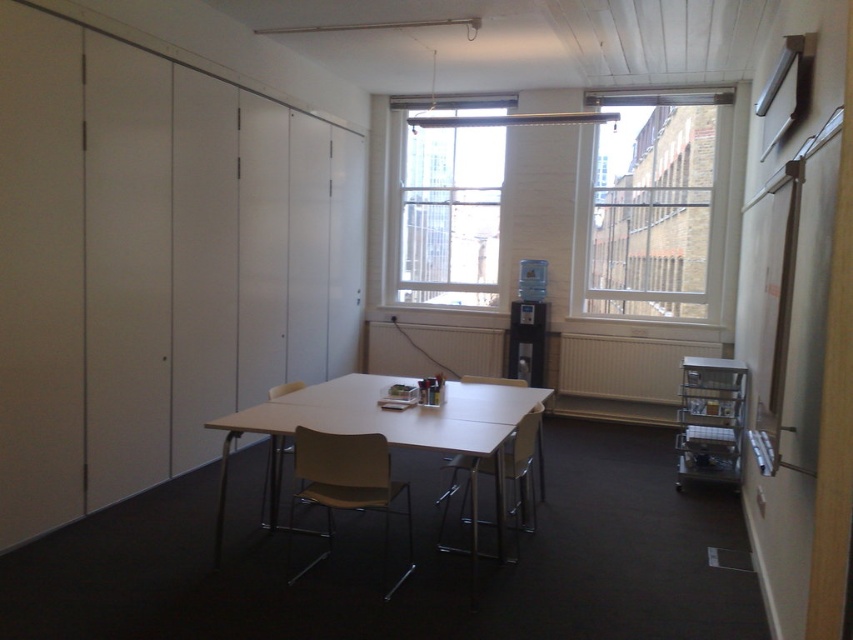
You are standing at the entrance of the meeting room and see two points marked on the floor. The first point is labeled as point (444, 204) and the second point is labeled as point (508, 404). If you face the direction of the folding doors on the left, which point is located further away from you?

Point (444, 204) is behind point (508, 404), so when facing the folding doors on the left, point (444, 204) is further away from you.

You are a delivery person who needs to place a large package that is 3 meters long in the room. The package must be placed between the clear glass window at center and the white plastic table at center. Is there enough space between them to fit the package?

The distance between the clear glass window at center and the white plastic table at center is 3.33 meters, which is slightly longer than the 3 meter package. Therefore, the package can fit between them with a small amount of space remaining.